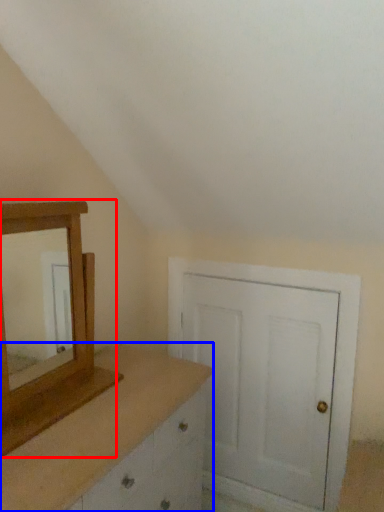
Question: Among these objects, which one is farthest to the camera, medicine cabinet (highlighted by a red box) or chest of drawers (highlighted by a blue box)?

Choices:
 (A) medicine cabinet
 (B) chest of drawers

Answer: (A)